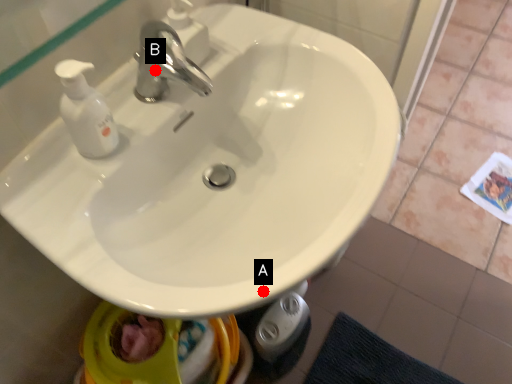
Question: Two points are circled on the image, labeled by A and B beside each circle. Which point is closer to the camera?

Choices:
 (A) A is closer
 (B) B is closer

Answer: (A)